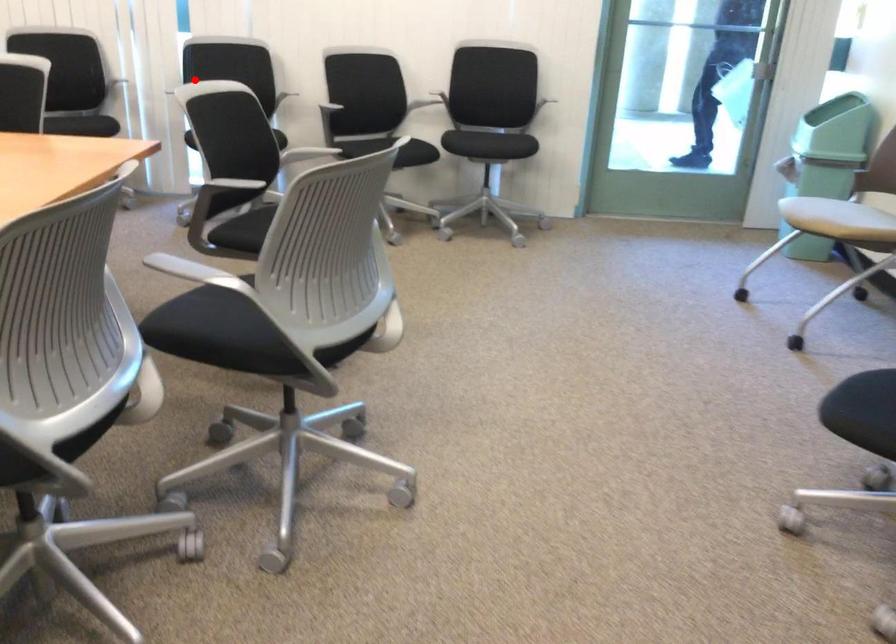
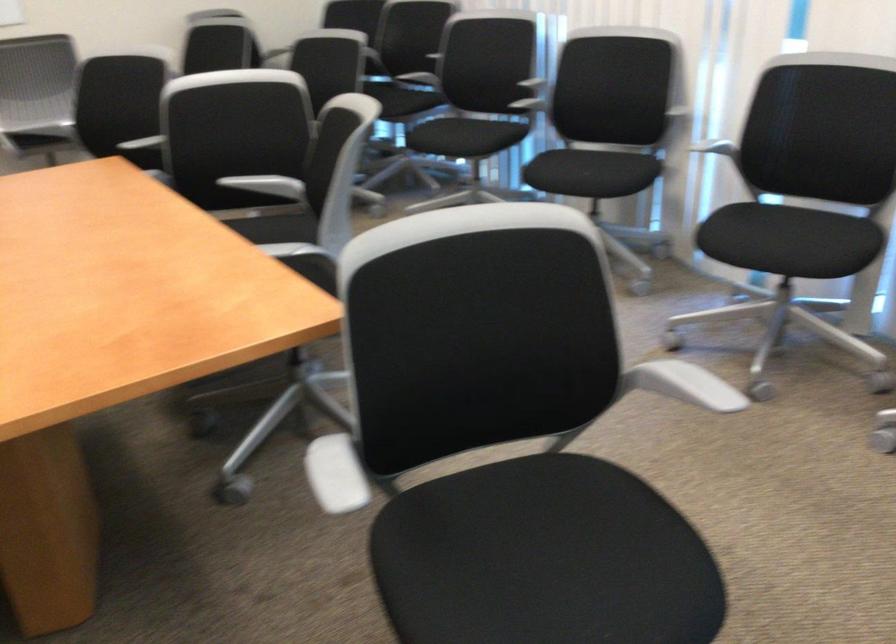
Locate, in the second image, the point that corresponds to the highlighted location in the first image.

(718, 149)